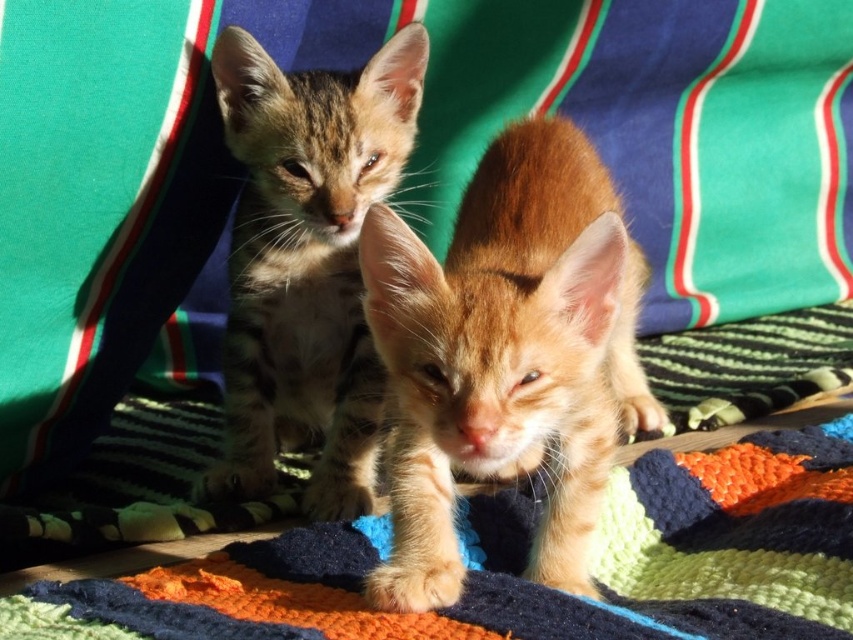
Is knitted wool blanket at center to the left of tabby fur kitten at center from the viewer's perspective?

No, knitted wool blanket at center is not to the left of tabby fur kitten at center.

Based on the photo, can you confirm if knitted wool blanket at center is positioned to the right of tabby fur kitten at center?

Yes, knitted wool blanket at center is to the right of tabby fur kitten at center.

Is point (479, 568) positioned in front of point (260, 240)?

Yes, it is.

The image size is (853, 640). What are the coordinates of `knitted wool blanket at center` in the screenshot? It's located at (521, 563).

Does orange fur kitten at center have a lesser width compared to knitted wool blanket at center?

Indeed, orange fur kitten at center has a lesser width compared to knitted wool blanket at center.

Who is more forward, (589, 246) or (344, 596)?

Point (589, 246) is more forward.

Who is more distant from viewer, (602, 355) or (613, 484)?

Point (613, 484)

Where is `orange fur kitten at center`? orange fur kitten at center is located at coordinates (506, 356).

Identify the location of orange fur kitten at center. (506, 356).

Is point (476, 172) less distant than point (289, 396)?

Yes, point (476, 172) is closer to viewer.

The image size is (853, 640). I want to click on orange fur kitten at center, so click(506, 356).